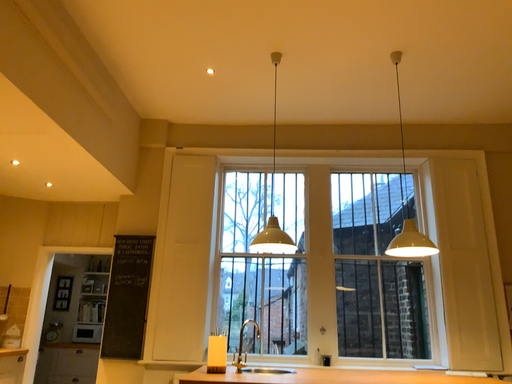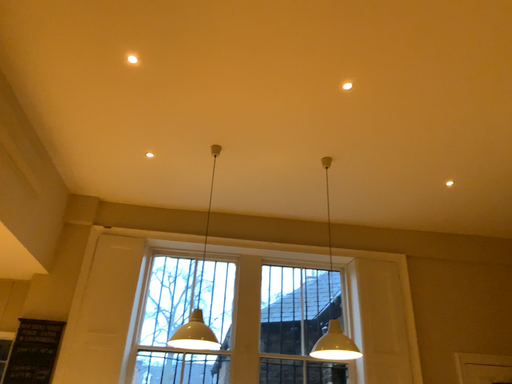
Question: How did the camera likely rotate when shooting the video?

Choices:
 (A) rotated right
 (B) rotated left

Answer: (A)